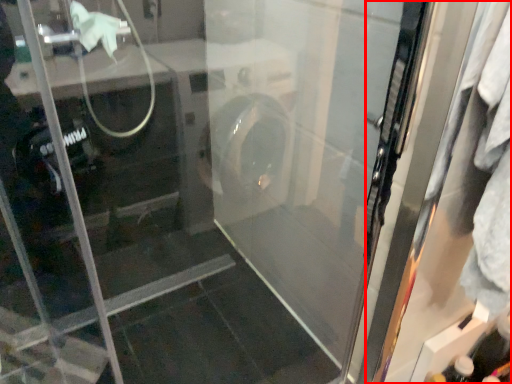
Question: Where is screen door (annotated by the red box) located in relation to bottle in the image?

Choices:
 (A) left
 (B) right

Answer: (A)